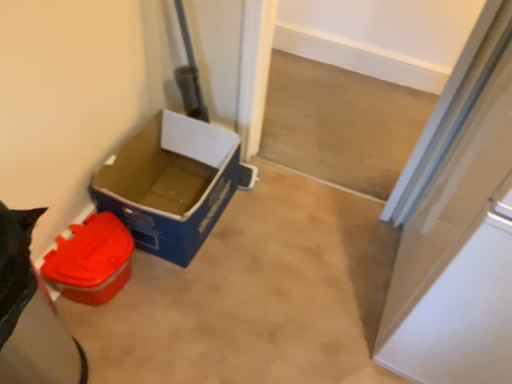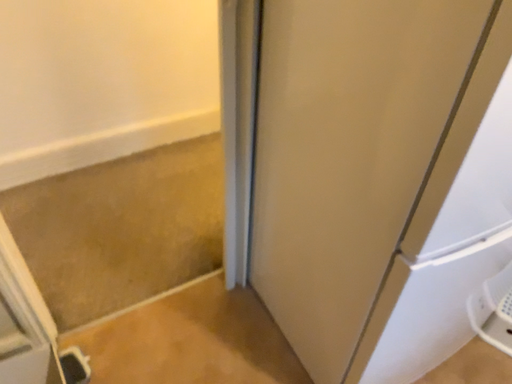
Question: How did the camera likely rotate when shooting the video?

Choices:
 (A) rotated right
 (B) rotated left

Answer: (A)